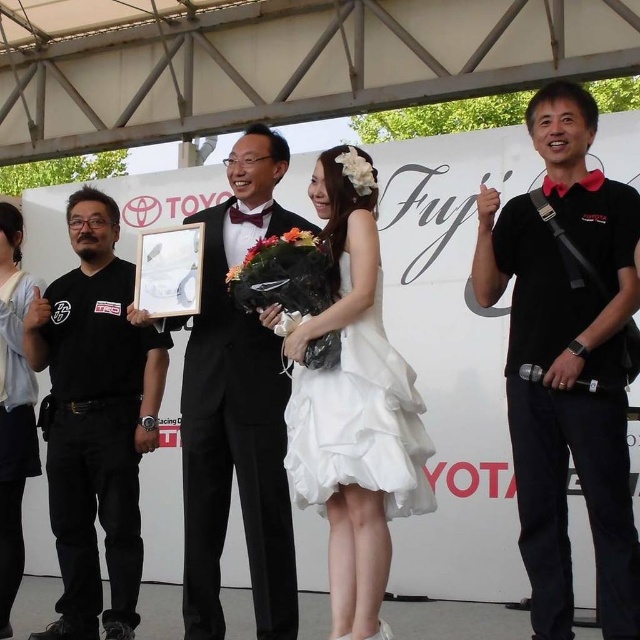
From the picture: Can you confirm if white satin dress at center is positioned to the left of white fabric flower at center?

Indeed, white satin dress at center is positioned on the left side of white fabric flower at center.

Between white satin dress at center and white fabric flower at center, which one has more height?

white satin dress at center

Is point (413, 401) farther from viewer compared to point (342, 161)?

No, it is not.

You are a GUI agent. You are given a task and a screenshot of the screen. Output one action in this format:
    pyautogui.click(x=<x>, y=<y>)
    Task: Click on the white satin dress at center
    
    Given the screenshot: What is the action you would take?
    pyautogui.click(x=358, y=410)

Which is more to the left, black matte shirt at right or black matte t-shirt at left?

From the viewer's perspective, black matte t-shirt at left appears more on the left side.

This screenshot has width=640, height=640. What do you see at coordinates (566, 362) in the screenshot?
I see `black matte shirt at right` at bounding box center [566, 362].

What do you see at coordinates (566, 362) in the screenshot? I see `black matte shirt at right` at bounding box center [566, 362].

In order to click on black matte shirt at right in this screenshot , I will do `click(566, 362)`.

Between white satin dress at center and floral bouquet at center, which one appears on the left side from the viewer's perspective?

From the viewer's perspective, floral bouquet at center appears more on the left side.

Is white satin dress at center smaller than floral bouquet at center?

Actually, white satin dress at center might be larger than floral bouquet at center.

Identify the location of white satin dress at center. (358, 410).